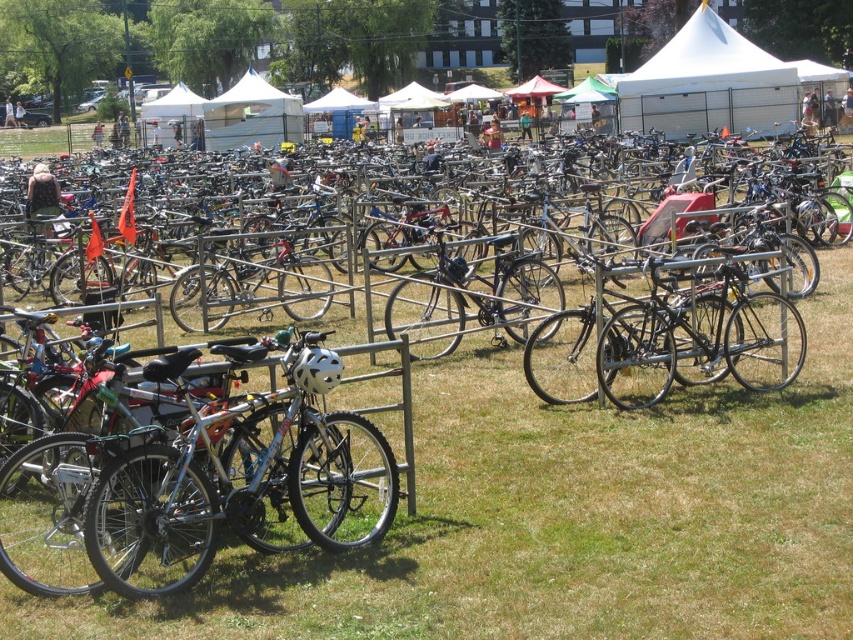
Does silver metallic bicycle at center have a larger size compared to white canvas tent at upper right?

No, silver metallic bicycle at center is not bigger than white canvas tent at upper right.

Find the location of a particular element. The image size is (853, 640). silver metallic bicycle at center is located at coordinates (242, 477).

Based on the photo, between shiny silver bicycle at center and white fabric tent at center, which one appears on the right side from the viewer's perspective?

shiny silver bicycle at center

Can you confirm if shiny silver bicycle at center is wider than white fabric tent at center?

Yes, shiny silver bicycle at center is wider than white fabric tent at center.

The height and width of the screenshot is (640, 853). I want to click on shiny silver bicycle at center, so click(828, 326).

Can you confirm if silver metallic bicycle at center is smaller than white fabric tent at center?

Correct, silver metallic bicycle at center occupies less space than white fabric tent at center.

Who is taller, silver metallic bicycle at center or white fabric tent at center?

white fabric tent at center is taller.

Locate an element on the screen. Image resolution: width=853 pixels, height=640 pixels. silver metallic bicycle at center is located at coordinates (242, 477).